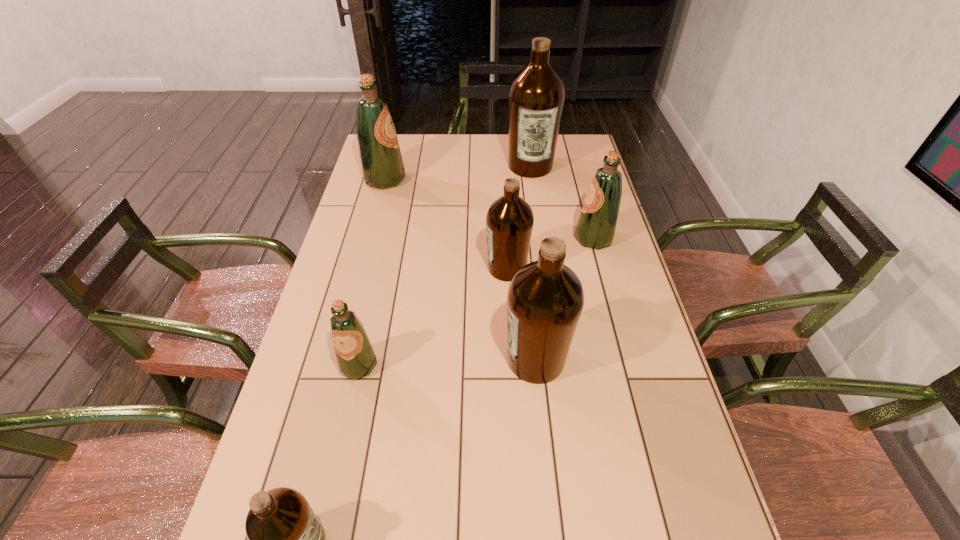
Locate an element on the screen. Image resolution: width=960 pixels, height=540 pixels. the biggest brown olive oil is located at coordinates (536, 97).

Identify the location of the tallest object. This screenshot has width=960, height=540. (536, 97).

At what (x,y) coordinates should I click in order to perform the action: click on the biggest green olive oil. Please return your answer as a coordinate pair (x, y). Image resolution: width=960 pixels, height=540 pixels. Looking at the image, I should click on (382, 167).

Where is `the second biggest brown olive oil`? The image size is (960, 540). the second biggest brown olive oil is located at coordinates (545, 299).

Where is `the fifth nearest olive oil`? This screenshot has height=540, width=960. the fifth nearest olive oil is located at coordinates click(596, 227).

Where is `the rightmost green olive oil`? the rightmost green olive oil is located at coordinates (596, 227).

The height and width of the screenshot is (540, 960). I want to click on the fourth farthest object, so click(509, 221).

Image resolution: width=960 pixels, height=540 pixels. I want to click on the third biggest brown olive oil, so click(x=509, y=221).

Image resolution: width=960 pixels, height=540 pixels. Find the location of `the nearest green olive oil`. the nearest green olive oil is located at coordinates (354, 352).

Find the location of `vacant space situated 0.350m on the label of the farthest brown olive oil`. vacant space situated 0.350m on the label of the farthest brown olive oil is located at coordinates (541, 244).